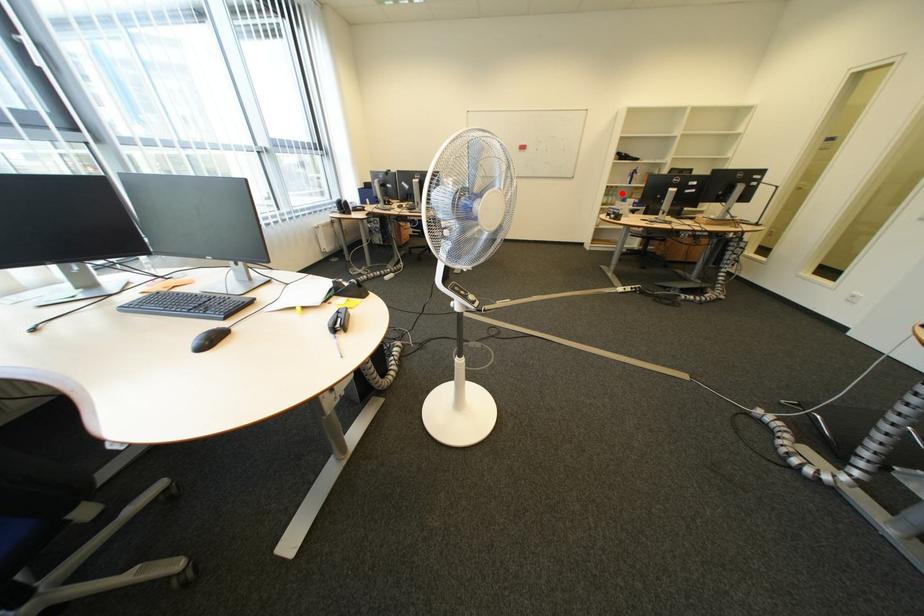
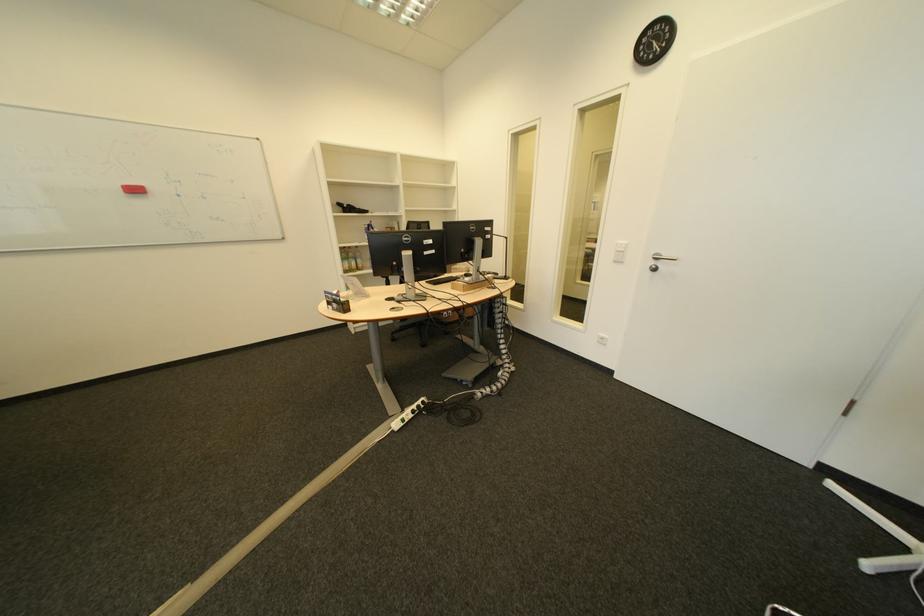
Question: I am providing you with two images of the same scene from different viewpoints. A red point is shown in image1. For the corresponding object point in image2, is it positioned nearer or farther from the camera?

Choices:
 (A) Nearer
 (B) Farther

Answer: (B)